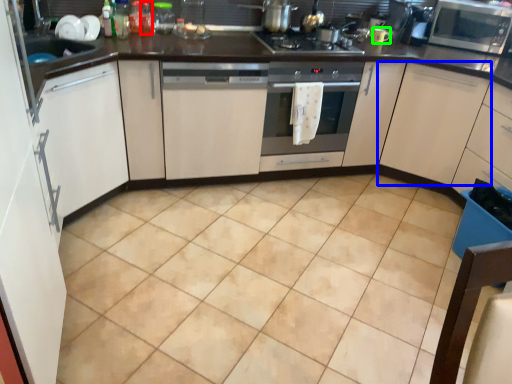
Question: Which object is positioned farthest from bottle (highlighted by a red box)? Select from cabinetry (highlighted by a blue box) and appliance (highlighted by a green box).

Choices:
 (A) cabinetry
 (B) appliance

Answer: (A)